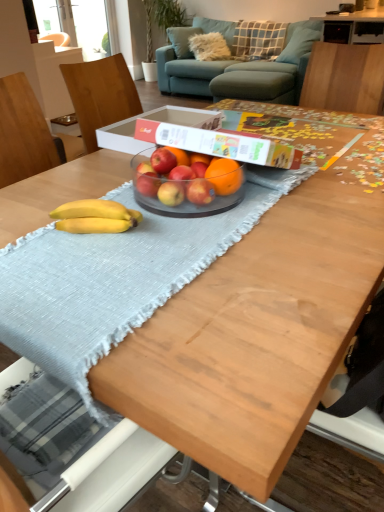
Identify the location of free space that is to the left of yellow matte apple at center, the 3th apple in the right-to-left sequence. (121, 204).